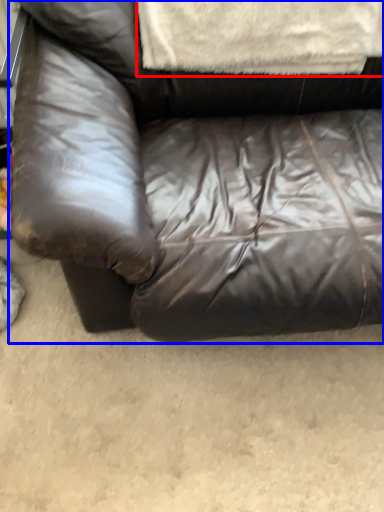
Question: Among these objects, which one is nearest to the camera, blanket (highlighted by a red box) or studio couch (highlighted by a blue box)?

Choices:
 (A) blanket
 (B) studio couch

Answer: (B)